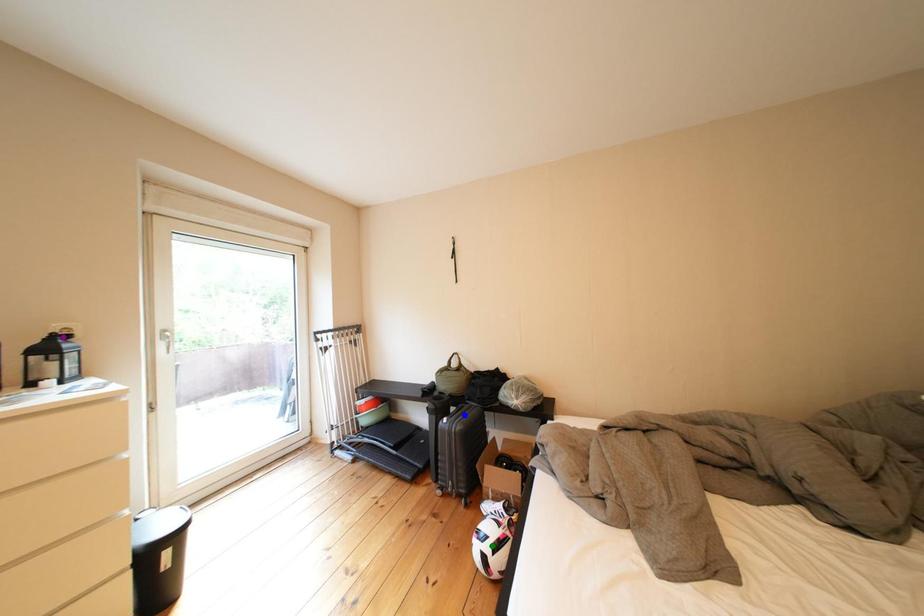
In the scene shown: Order these from nearest to farthest:
purple point
green point
blue point

purple point < green point < blue point